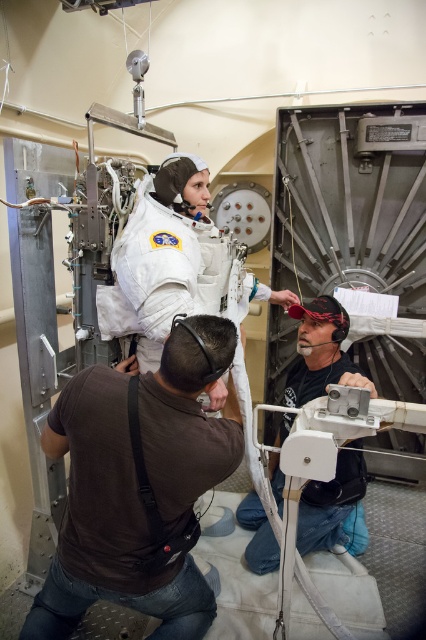
Question: Does brown fabric shirt at lower left appear on the left side of matte black helmet at lower right?

Choices:
 (A) no
 (B) yes

Answer: (B)

Question: Among these points, which one is farthest from the camera?

Choices:
 (A) (172, 515)
 (B) (334, 348)

Answer: (B)

Question: Is brown fabric shirt at lower left to the right of matte black helmet at lower right from the viewer's perspective?

Choices:
 (A) no
 (B) yes

Answer: (A)

Question: Does brown fabric shirt at lower left come in front of matte black helmet at lower right?

Choices:
 (A) no
 (B) yes

Answer: (B)